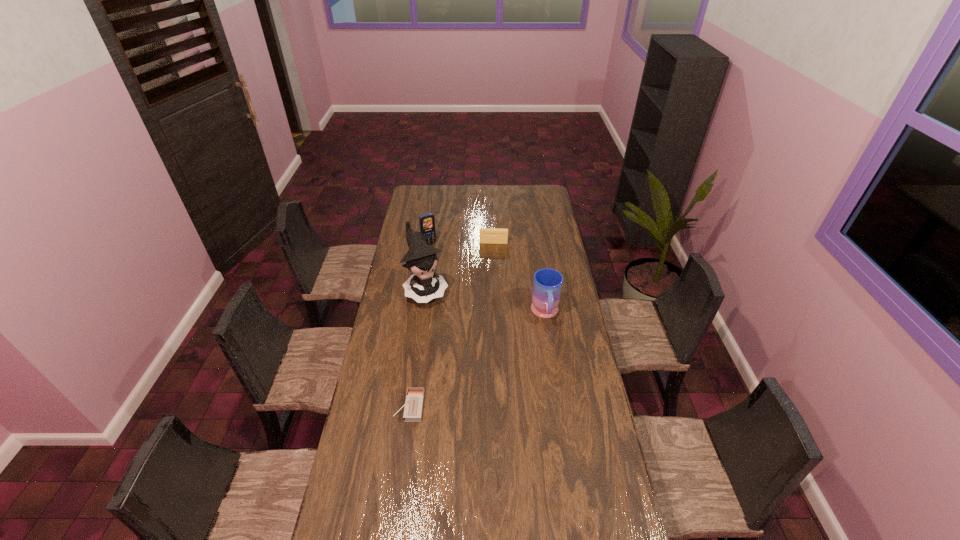
Locate an element on the screen. The image size is (960, 540). free space located 0.370m at the front of the videotape with spools is located at coordinates (492, 289).

Find the location of a particular element. Image resolution: width=960 pixels, height=540 pixels. free space located 0.230m at the front of the videotape with spools is located at coordinates (492, 271).

Identify the location of vacant space located at the front of the videotape with spools. The height and width of the screenshot is (540, 960). (492, 265).

Where is `free space located 0.390m at the face of the tallest object`? free space located 0.390m at the face of the tallest object is located at coordinates (468, 369).

Locate an element on the screen. vacant space located at the face of the tallest object is located at coordinates (446, 331).

At what (x,y) coordinates should I click in order to perform the action: click on blank space located at the face of the tallest object. Please return your answer as a coordinate pair (x, y). Looking at the image, I should click on (468, 370).

The width and height of the screenshot is (960, 540). I want to click on free point located 0.280m on the screen of the cellular telephone, so click(x=451, y=276).

The image size is (960, 540). Identify the location of vacant space situated on the screen of the cellular telephone. (439, 256).

The width and height of the screenshot is (960, 540). I want to click on vacant area located on the screen of the cellular telephone, so click(x=451, y=276).

In order to click on matchbox at the left edge in this screenshot , I will do `click(413, 409)`.